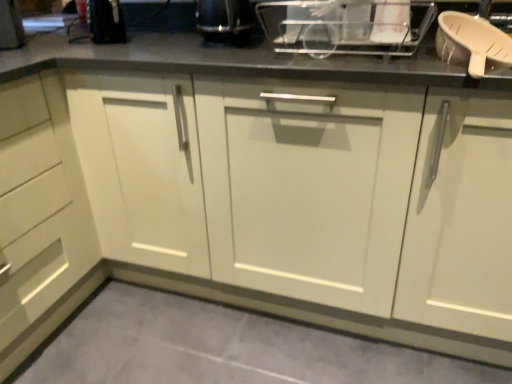
Identify the location of vacant space positioned to the left of black plastic kettle at upper center, acting as the 1th appliance starting from the left. The image size is (512, 384). (163, 47).